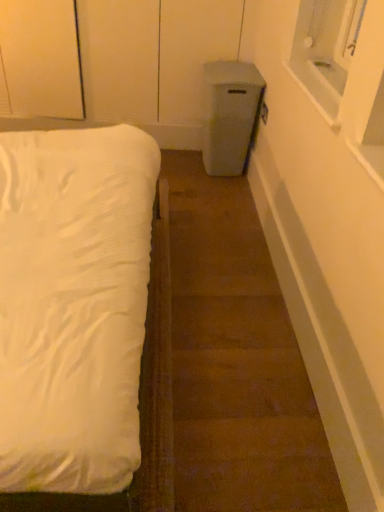
Describe the element at coordinates (73, 313) in the screenshot. I see `white soft bed at left` at that location.

What is the approximate height of white soft bed at left?

It is 1.02 meters.

In order to click on white soft bed at left in this screenshot , I will do `click(73, 313)`.

What is the approximate width of white soft bed at left?

white soft bed at left is 32.66 inches wide.

This screenshot has width=384, height=512. In order to click on brown carpet at lower left in this screenshot , I will do `click(237, 361)`.

Describe the element at coordinates (237, 361) in the screenshot. I see `brown carpet at lower left` at that location.

Find the location of `white soft bed at left`. white soft bed at left is located at coordinates (73, 313).

Between white soft bed at left and brown carpet at lower left, which one appears on the left side from the viewer's perspective?

Positioned to the left is white soft bed at left.

Which object is closer to the camera, white soft bed at left or brown carpet at lower left?

white soft bed at left is in front.

Which is more distant, (48,192) or (199,315)?

The point (199,315) is behind.

From the image's perspective, would you say white soft bed at left is shown under brown carpet at lower left?

No, from the image's perspective, white soft bed at left is not below brown carpet at lower left.

From a real-world perspective, which is physically above, white soft bed at left or brown carpet at lower left?

white soft bed at left is physically above.

Is white soft bed at left wider or thinner than brown carpet at lower left?

In the image, white soft bed at left appears to be wider than brown carpet at lower left.

Can you confirm if white soft bed at left is taller than brown carpet at lower left?

Yes, white soft bed at left is taller than brown carpet at lower left.

Which of these two, white soft bed at left or brown carpet at lower left, is bigger?

With larger size is white soft bed at left.

Looking at this image, is brown carpet at lower left a part of white soft bed at left?

No, brown carpet at lower left is not a part of white soft bed at left.

Are white soft bed at left and brown carpet at lower left making contact?

No, white soft bed at left is not making contact with brown carpet at lower left.

Could you tell me if white soft bed at left is turned towards brown carpet at lower left?

Yes.

Can you tell me how much white soft bed at left and brown carpet at lower left differ in facing direction?

They differ by 178 degrees in their facing directions.

How distant is white soft bed at left from brown carpet at lower left?

22.48 inches.

At what (x,y) coordinates should I click in order to perform the action: click on bed on the left of brown carpet at lower left. Please return your answer as a coordinate pair (x, y). This screenshot has height=512, width=384. Looking at the image, I should click on (73, 313).

Which is more to the right, brown carpet at lower left or white soft bed at left?

From the viewer's perspective, brown carpet at lower left appears more on the right side.

Consider the image. Which is behind, brown carpet at lower left or white soft bed at left?

brown carpet at lower left.

Does point (302, 457) lie behind point (59, 191)?

No, it is in front of (59, 191).

In the scene shown: From the image's perspective, is brown carpet at lower left over white soft bed at left?

No, from the image's perspective, brown carpet at lower left is not over white soft bed at left.

From a real-world perspective, is brown carpet at lower left positioned under white soft bed at left based on gravity?

Yes, from a real-world perspective, brown carpet at lower left is under white soft bed at left.

Considering the sizes of brown carpet at lower left and white soft bed at left in the image, is brown carpet at lower left wider or thinner than white soft bed at left?

In the image, brown carpet at lower left appears to be more narrow than white soft bed at left.

Considering the relative sizes of brown carpet at lower left and white soft bed at left in the image provided, is brown carpet at lower left taller than white soft bed at left?

No, brown carpet at lower left is not taller than white soft bed at left.

Which of these two, brown carpet at lower left or white soft bed at left, is bigger?

white soft bed at left.

Is brown carpet at lower left surrounding white soft bed at left?

No, white soft bed at left is not surrounded by brown carpet at lower left.

Does brown carpet at lower left touch white soft bed at left?

No.

Is brown carpet at lower left facing away from white soft bed at left?

No, white soft bed at left is not at the back of brown carpet at lower left.

Looking at this image, how different are the orientations of brown carpet at lower left and white soft bed at left in degrees?

178 degrees.

At what (x,y) coordinates should I click in order to perform the action: click on stairwell below the white soft bed at left (from the image's perspective). Please return your answer as a coordinate pair (x, y). The height and width of the screenshot is (512, 384). Looking at the image, I should click on (237, 361).

This screenshot has height=512, width=384. Find the location of `bed to the left of brown carpet at lower left`. bed to the left of brown carpet at lower left is located at coordinates (73, 313).

Where is `bed positioned vertically above the brown carpet at lower left (from a real-world perspective)`? The image size is (384, 512). bed positioned vertically above the brown carpet at lower left (from a real-world perspective) is located at coordinates (73, 313).